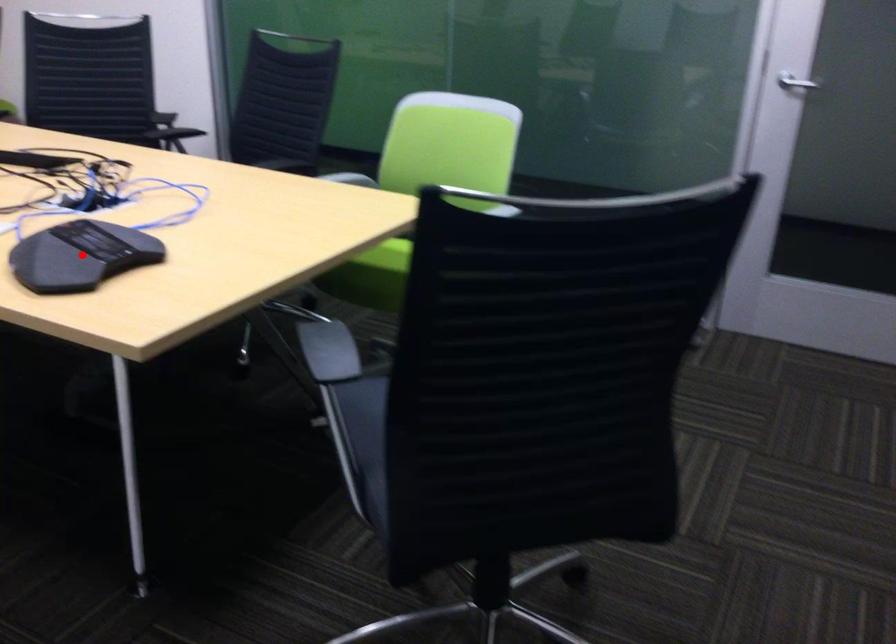
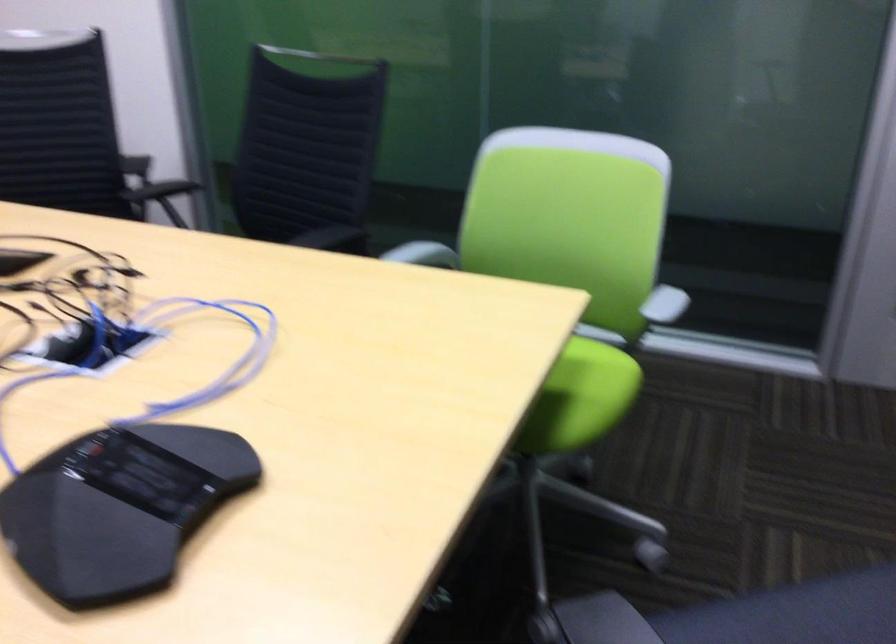
Locate, in the second image, the point that corresponds to the highlighted location in the first image.

(119, 507)